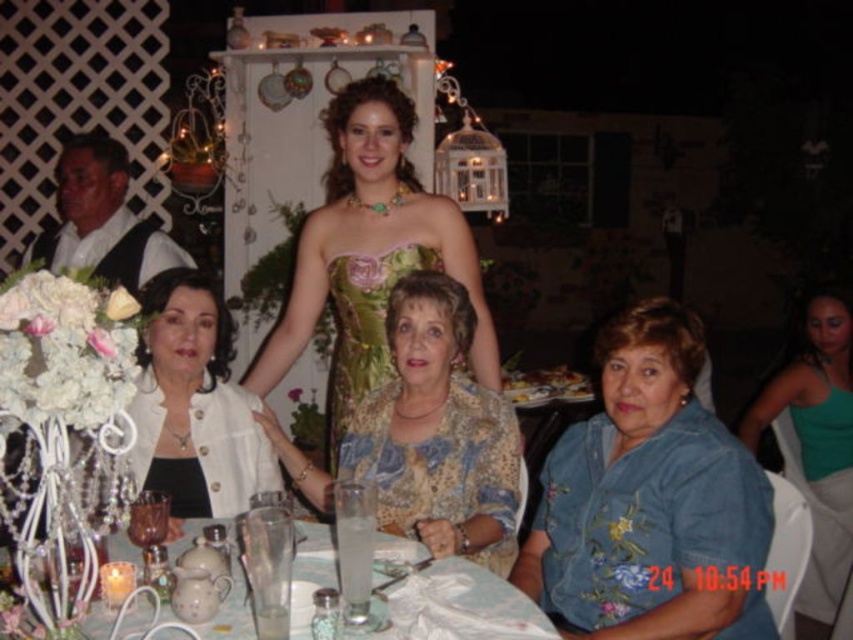
You are a photographer at this event and need to capture a photo of both the blue floral blouse at lower right and the white textured blazer at lower left. Based on their positions, which one is closer to the camera?

The blue floral blouse at lower right is below the white textured blazer at lower left, meaning it is closer to the camera since it appears lower in the image.

You are a photographer at a wedding reception. You need to position yourself so that both the blue floral blouse at lower right and the white textured blazer at lower left are visible in your shot. Based on their positions, which side should you stand to ensure both are in frame?

You should stand to the left side of the table because the blue floral blouse at lower right is to the right of the white textured blazer at lower left, so positioning yourself to the left would allow both to be captured in the frame.

From the picture: You are a photographer taking a picture of the table setup at this event. The blue floral blouse at lower right is currently positioned at coordinates 0.783, 0.763. To ensure it is centered in the frame, which direction should you move the camera?

The blue floral blouse at lower right is at point [650,500]. To center it, move the camera to the left and slightly downward since the current coordinates are closer to the lower right corner of the frame.